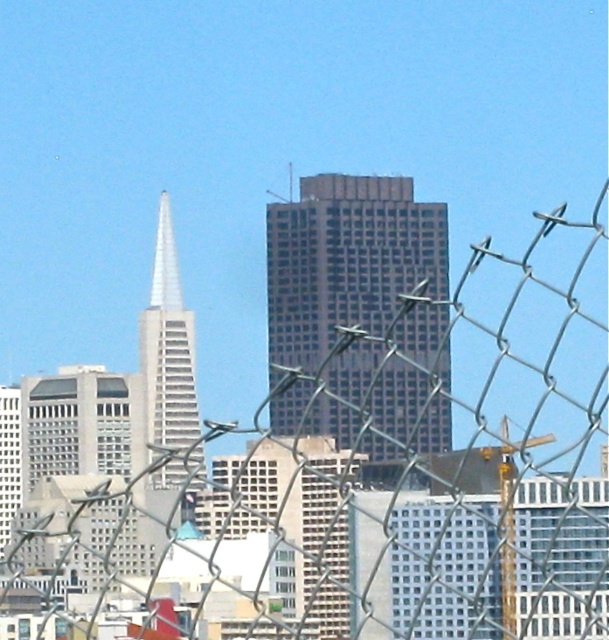
Who is taller, metal chain-link fence at center or dark glass skyscraper at center?

Standing taller between the two is metal chain-link fence at center.

In order to click on metal chain-link fence at center in this screenshot , I will do `click(501, 458)`.

In the scene shown: Who is positioned more to the right, silver glass tower at center or shiny silver spire at center?

From the viewer's perspective, silver glass tower at center appears more on the right side.

Is point (157, 257) positioned in front of point (161, 205)?

That is True.

Does point (177, 358) lie in front of point (174, 269)?

Yes.

At what (x,y) coordinates should I click in order to perform the action: click on silver glass tower at center. Please return your answer as a coordinate pair (x, y). Looking at the image, I should click on (169, 364).

Does metal chain-link fence at center have a smaller size compared to shiny silver spire at center?

Incorrect, metal chain-link fence at center is not smaller in size than shiny silver spire at center.

Describe the element at coordinates (501, 458) in the screenshot. This screenshot has width=609, height=640. I see `metal chain-link fence at center` at that location.

The image size is (609, 640). What are the coordinates of `metal chain-link fence at center` in the screenshot? It's located at (501, 458).